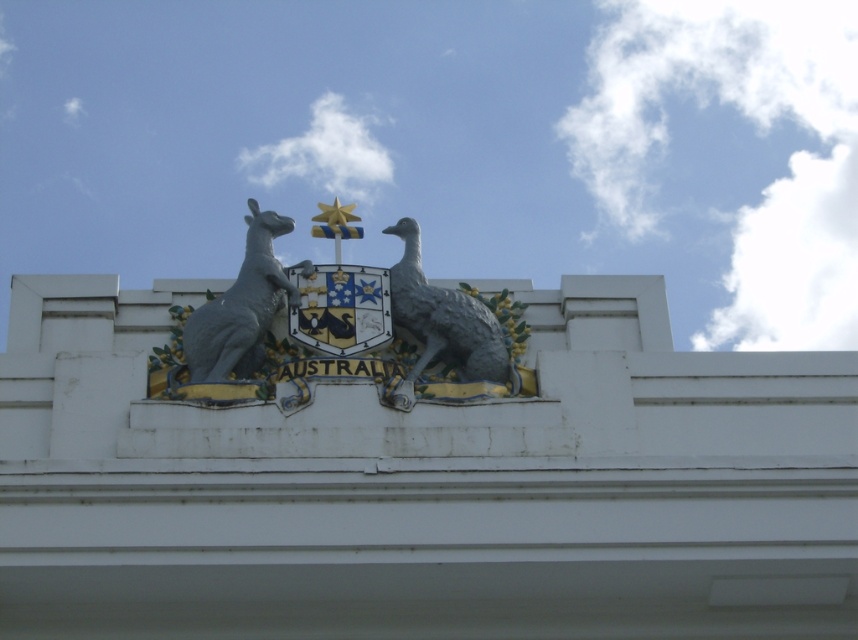
Is point (479, 360) farther from camera compared to point (275, 260)?

No, it is in front of (275, 260).

Does gray metallic bird at center appear over gray metallic kangaroo at upper left?

Incorrect, gray metallic bird at center is not positioned above gray metallic kangaroo at upper left.

Who is more forward, (411, 269) or (186, 365)?

Point (186, 365)

The height and width of the screenshot is (640, 858). Identify the location of gray metallic bird at center. (446, 321).